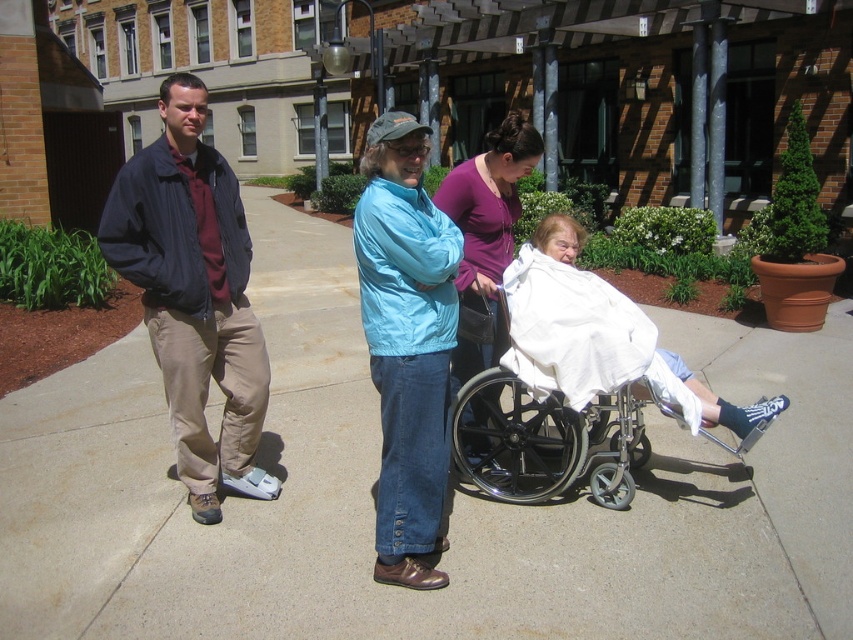
Is matte blue jacket at center wider than light blue nylon jacket at center?

Yes.

How much distance is there between matte blue jacket at center and light blue nylon jacket at center?

matte blue jacket at center is 95.04 centimeters from light blue nylon jacket at center.

The height and width of the screenshot is (640, 853). In order to click on matte blue jacket at center in this screenshot , I will do `click(193, 294)`.

Can you confirm if concrete at center is smaller than matte purple shirt at center?

No.

In the scene shown: Can you confirm if concrete at center is bigger than matte purple shirt at center?

Indeed, concrete at center has a larger size compared to matte purple shirt at center.

This screenshot has height=640, width=853. What do you see at coordinates (453, 502) in the screenshot?
I see `concrete at center` at bounding box center [453, 502].

Find the location of a particular element. concrete at center is located at coordinates (453, 502).

Is light blue nylon jacket at center taller than metallic silver wheelchair at center?

Yes.

Does light blue nylon jacket at center lie in front of metallic silver wheelchair at center?

That is True.

Based on the photo, who is more distant from viewer, (457,262) or (647,451)?

The point (647,451) is behind.

Image resolution: width=853 pixels, height=640 pixels. In order to click on light blue nylon jacket at center in this screenshot , I will do `click(405, 342)`.